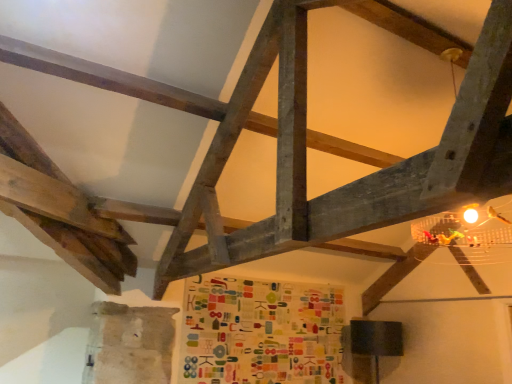
Locate an element on the screen. This screenshot has width=512, height=384. black matte lamp at lower right is located at coordinates (376, 339).

The height and width of the screenshot is (384, 512). What do you see at coordinates (376, 339) in the screenshot?
I see `black matte lamp at lower right` at bounding box center [376, 339].

At what (x,y) coordinates should I click in order to perform the action: click on black matte lamp at lower right. Please return your answer as a coordinate pair (x, y). This screenshot has height=384, width=512. Looking at the image, I should click on (376, 339).